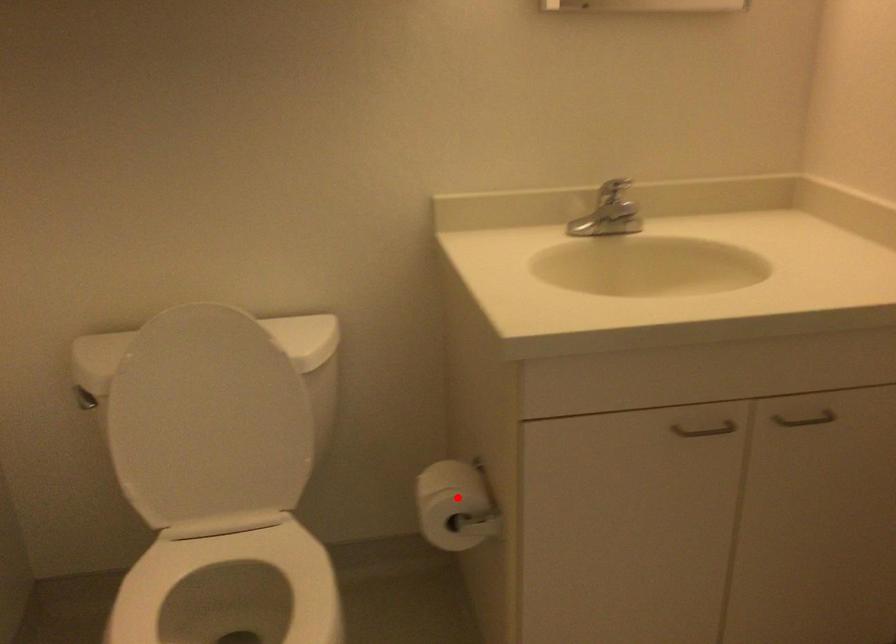
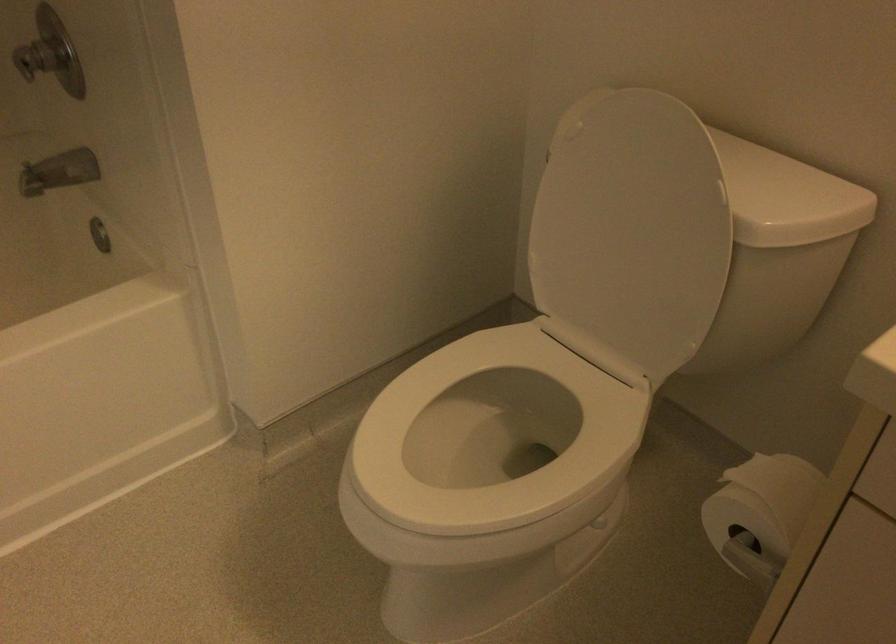
The point at the highlighted location is marked in the first image. Where is the corresponding point in the second image?

(760, 513)